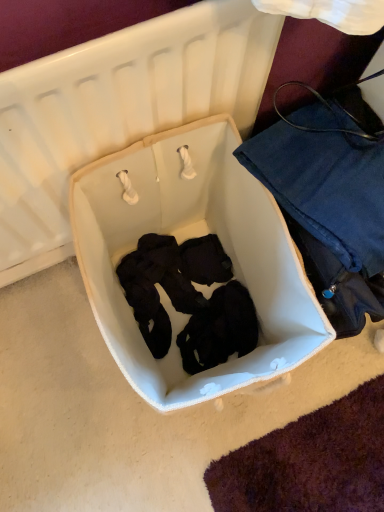
Describe the element at coordinates (185, 239) in the screenshot. I see `white fabric infant bed at center` at that location.

The width and height of the screenshot is (384, 512). I want to click on white fabric infant bed at center, so click(x=185, y=239).

What do you see at coordinates (330, 199) in the screenshot? The width and height of the screenshot is (384, 512). I see `denim fabric at right` at bounding box center [330, 199].

Locate an element on the screen. This screenshot has height=512, width=384. denim fabric at right is located at coordinates (330, 199).

Where is `white fabric infant bed at center`? white fabric infant bed at center is located at coordinates (185, 239).

Looking at this image, which object is positioned more to the right, white fabric infant bed at center or denim fabric at right?

denim fabric at right is more to the right.

In the image, is white fabric infant bed at center positioned in front of or behind denim fabric at right?

Visually, white fabric infant bed at center is located in front of denim fabric at right.

Is point (271, 282) closer to viewer compared to point (355, 332)?

No, it is not.

From the image's perspective, would you say white fabric infant bed at center is positioned over denim fabric at right?

Actually, white fabric infant bed at center appears below denim fabric at right in the image.

From a real-world perspective, is white fabric infant bed at center on denim fabric at right?

No, from a real-world perspective, white fabric infant bed at center is not over denim fabric at right

Looking at their sizes, would you say white fabric infant bed at center is wider or thinner than denim fabric at right?

Considering their sizes, white fabric infant bed at center looks broader than denim fabric at right.

In the scene shown: Is white fabric infant bed at center taller or shorter than denim fabric at right?

In the image, white fabric infant bed at center appears to be shorter than denim fabric at right.

Between white fabric infant bed at center and denim fabric at right, which one has larger size?

white fabric infant bed at center.

Would you say white fabric infant bed at center is inside or outside denim fabric at right?

white fabric infant bed at center exists outside the volume of denim fabric at right.

Is white fabric infant bed at center far away from denim fabric at right?

No, white fabric infant bed at center is not far away from denim fabric at right.

Is white fabric infant bed at center oriented towards denim fabric at right?

No, white fabric infant bed at center is not facing towards denim fabric at right.

Can you tell me how much white fabric infant bed at center and denim fabric at right differ in facing direction?

white fabric infant bed at center and denim fabric at right are facing 0.509 degrees away from each other.

Where is `clothing that is above the white fabric infant bed at center (from a real-world perspective)`? The image size is (384, 512). clothing that is above the white fabric infant bed at center (from a real-world perspective) is located at coordinates (330, 199).

Considering the positions of objects denim fabric at right and white fabric infant bed at center in the image provided, who is more to the left, denim fabric at right or white fabric infant bed at center?

From the viewer's perspective, white fabric infant bed at center appears more on the left side.

Considering the positions of objects denim fabric at right and white fabric infant bed at center in the image provided, who is in front, denim fabric at right or white fabric infant bed at center?

white fabric infant bed at center is in front.

Is point (327, 197) closer or farther from the camera than point (321, 329)?

Point (327, 197) is positioned farther from the camera compared to point (321, 329).

From the image's perspective, between denim fabric at right and white fabric infant bed at center, who is located below?

white fabric infant bed at center appears lower in the image.

From a real-world perspective, which object rests below the other?

white fabric infant bed at center.

Is denim fabric at right wider than white fabric infant bed at center?

In fact, denim fabric at right might be narrower than white fabric infant bed at center.

In terms of height, does denim fabric at right look taller or shorter compared to white fabric infant bed at center?

Clearly, denim fabric at right is taller compared to white fabric infant bed at center.

Does denim fabric at right have a smaller size compared to white fabric infant bed at center?

Yes, denim fabric at right is smaller than white fabric infant bed at center.

Is denim fabric at right surrounding white fabric infant bed at center?

No, white fabric infant bed at center is not inside denim fabric at right.

Is denim fabric at right next to white fabric infant bed at center?

They are not placed beside each other.

Is denim fabric at right facing away from white fabric infant bed at center?

No, denim fabric at right is not facing away from white fabric infant bed at center.

Where is `infant bed in front of the denim fabric at right`? The height and width of the screenshot is (512, 384). infant bed in front of the denim fabric at right is located at coordinates (185, 239).

This screenshot has height=512, width=384. In order to click on clothing lying behind the white fabric infant bed at center in this screenshot , I will do `click(330, 199)`.

Identify the location of infant bed in front of the denim fabric at right. The image size is (384, 512). (185, 239).